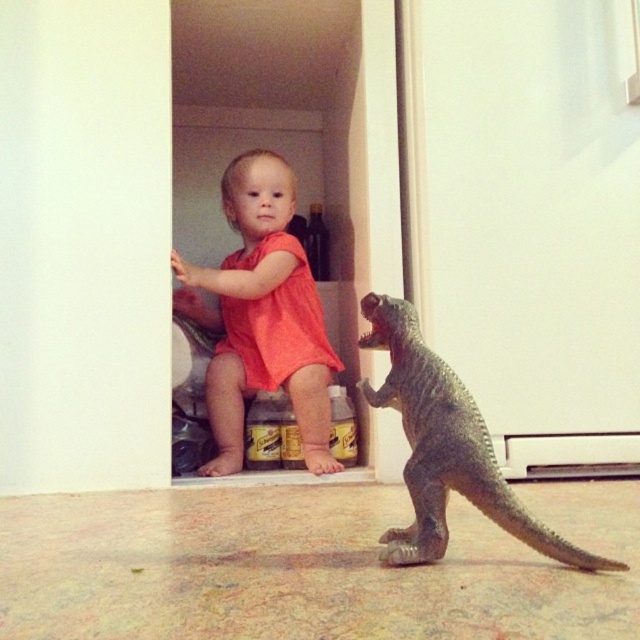
Question: Does matte orange romper at center have a smaller size compared to gray matte plastic dinosaur at lower right?

Choices:
 (A) no
 (B) yes

Answer: (A)

Question: Does matte orange romper at center appear on the left side of gray matte plastic dinosaur at lower right?

Choices:
 (A) yes
 (B) no

Answer: (A)

Question: Is matte orange romper at center thinner than gray matte plastic dinosaur at lower right?

Choices:
 (A) no
 (B) yes

Answer: (A)